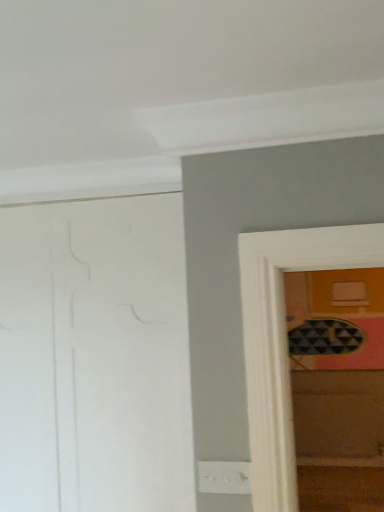
The height and width of the screenshot is (512, 384). In order to click on white matte door at left in this screenshot , I will do (x=95, y=357).

Describe the element at coordinates (95, 357) in the screenshot. The width and height of the screenshot is (384, 512). I see `white matte door at left` at that location.

At what (x,y) coordinates should I click in order to perform the action: click on white matte door at left. Please return your answer as a coordinate pair (x, y). The width and height of the screenshot is (384, 512). Looking at the image, I should click on (95, 357).